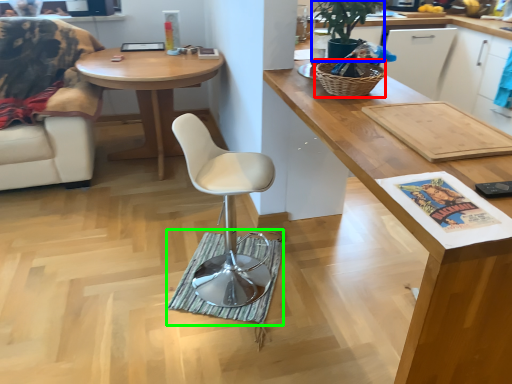
Question: Which object is the closest to the picnic basket (highlighted by a red box)? Choose among these: houseplant (highlighted by a blue box) or mat (highlighted by a green box).

Choices:
 (A) houseplant
 (B) mat

Answer: (A)